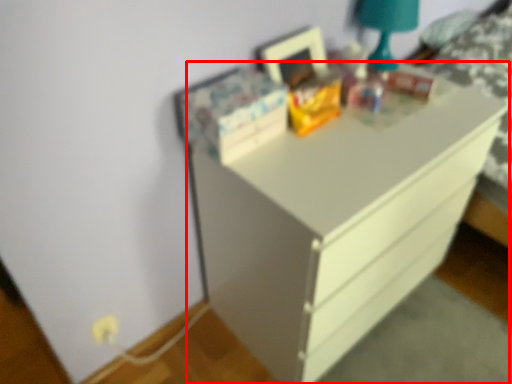
Question: From the image's perspective, what is the correct spatial relationship of chest of drawers (annotated by the red box) in relation to bedside lamp?

Choices:
 (A) above
 (B) below

Answer: (B)